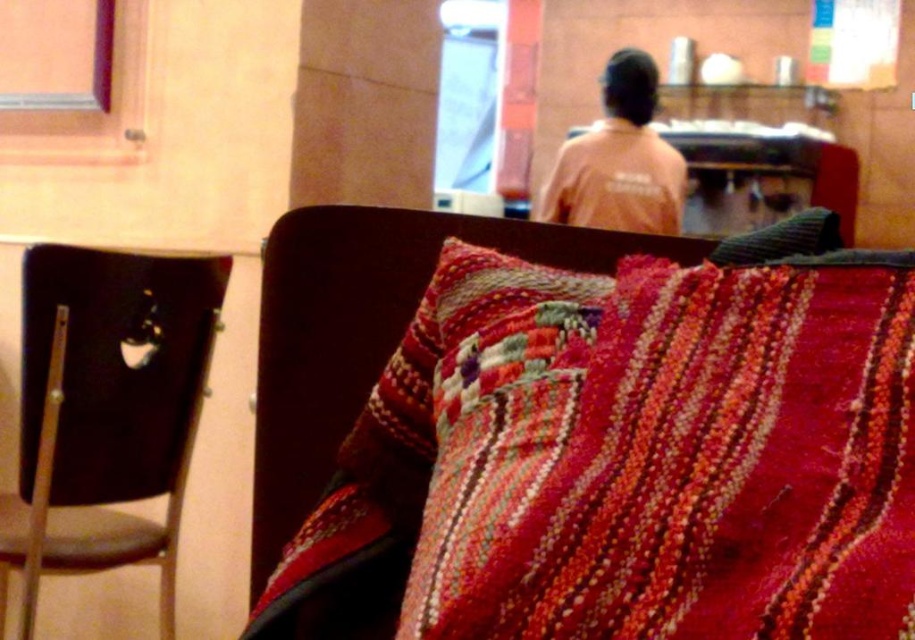
Who is lower down, wooden cushion at center or knitted fabric pillow at center?

knitted fabric pillow at center is below.

Is point (338, 280) more distant than point (395, 349)?

No, (338, 280) is closer to viewer.

Locate an element on the screen. This screenshot has height=640, width=915. wooden cushion at center is located at coordinates (364, 330).

Is knitted woolen blanket at center in front of textured gray pillow at center?

Yes, knitted woolen blanket at center is in front of textured gray pillow at center.

The height and width of the screenshot is (640, 915). I want to click on knitted woolen blanket at center, so click(x=661, y=451).

Which is more to the left, wooden cushion at center or textured gray pillow at center?

wooden cushion at center

Which is below, wooden cushion at center or textured gray pillow at center?

wooden cushion at center

Is point (256, 529) farther from viewer compared to point (792, 257)?

Yes, point (256, 529) is behind point (792, 257).

This screenshot has width=915, height=640. Identify the location of wooden cushion at center. (364, 330).